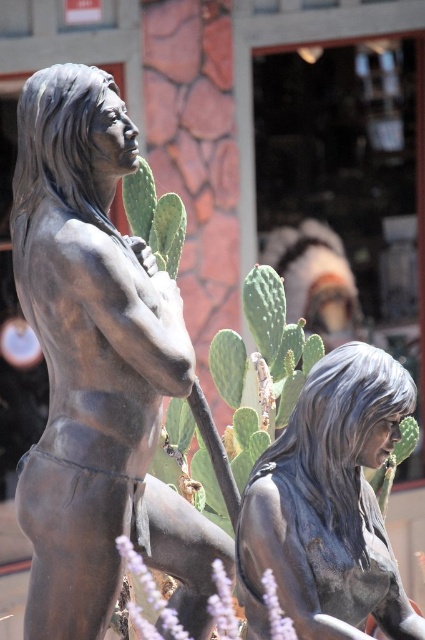
You are an art curator planning to place both the bronze statue at left and the shiny bronze statue at center in a new exhibition. Based on their widths, which statue should be placed on a wider base to ensure stability?

The bronze statue at left is wider than the shiny bronze statue at center, so it should be placed on a wider base to ensure stability.